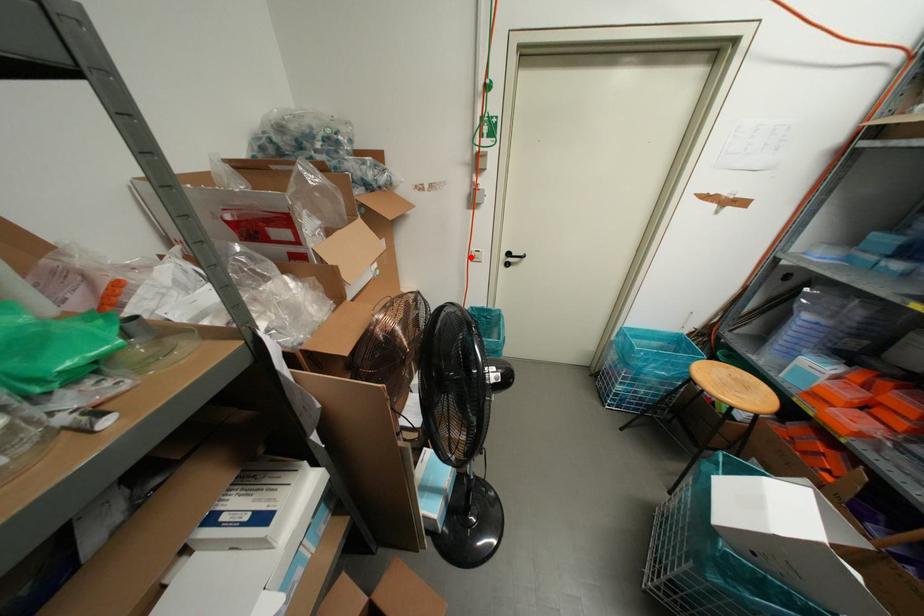
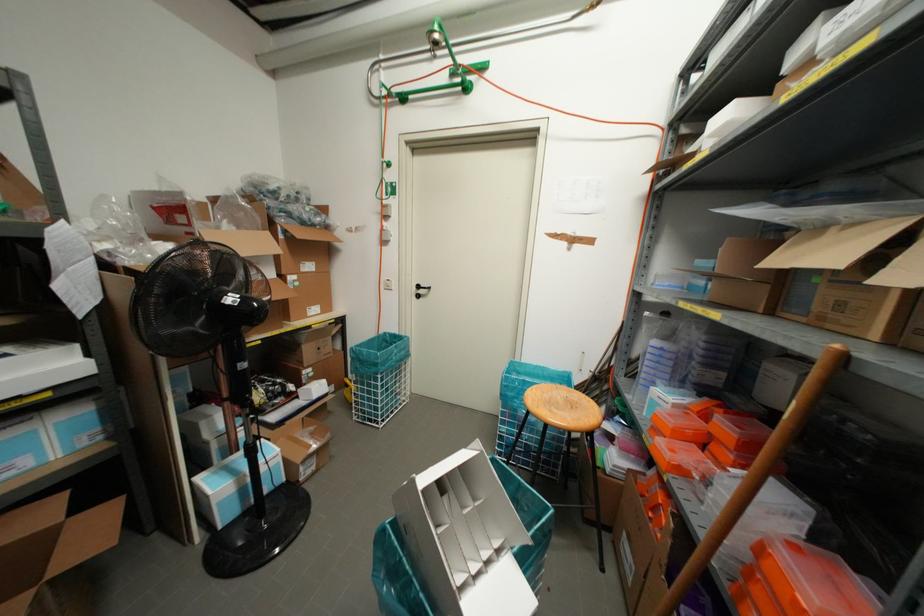
Question: I am providing you with two images of the same scene from different viewpoints. Given a red point in image1, look at the same physical point in image2. Is it:

Choices:
 (A) Closer to the viewpoint
 (B) Farther from the viewpoint

Answer: (B)